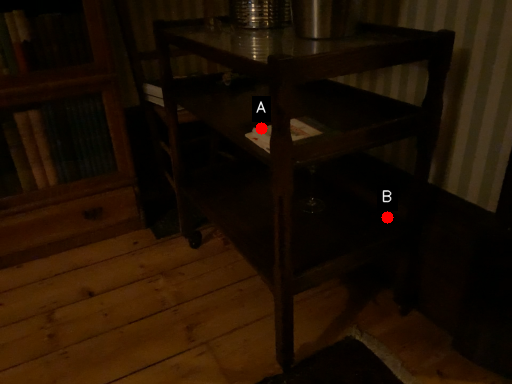
Question: Two points are circled on the image, labeled by A and B beside each circle. Which of the following is the farthest from the observer?

Choices:
 (A) A is further
 (B) B is further

Answer: (B)